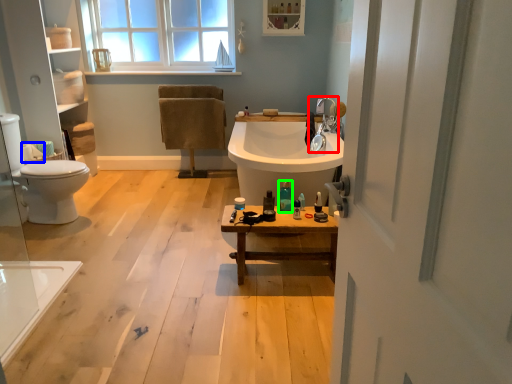
Question: Estimate the real-world distances between objects in this image. Which object is closer to tap (highlighted by a red box), toilet paper (highlighted by a blue box) or toiletry (highlighted by a green box)?

Choices:
 (A) toilet paper
 (B) toiletry

Answer: (B)